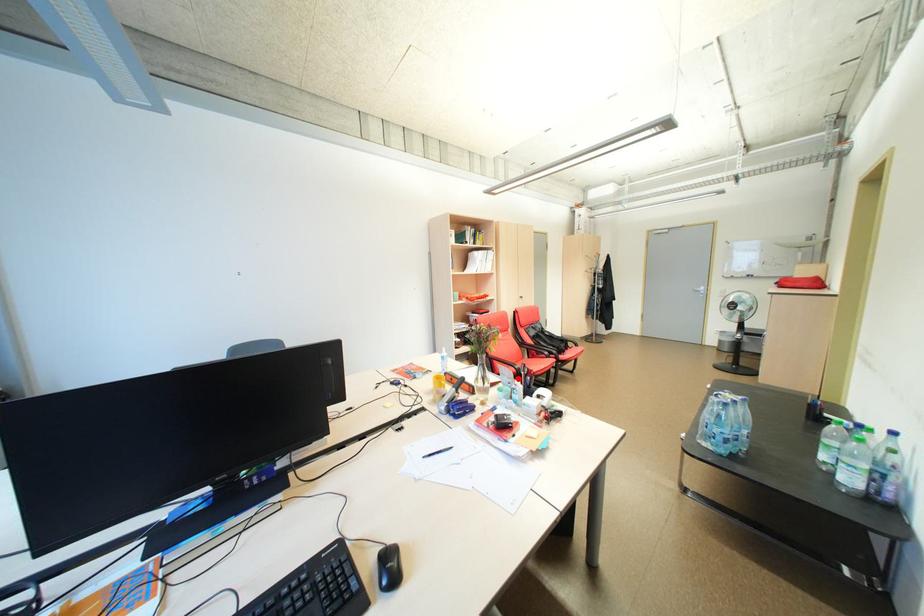
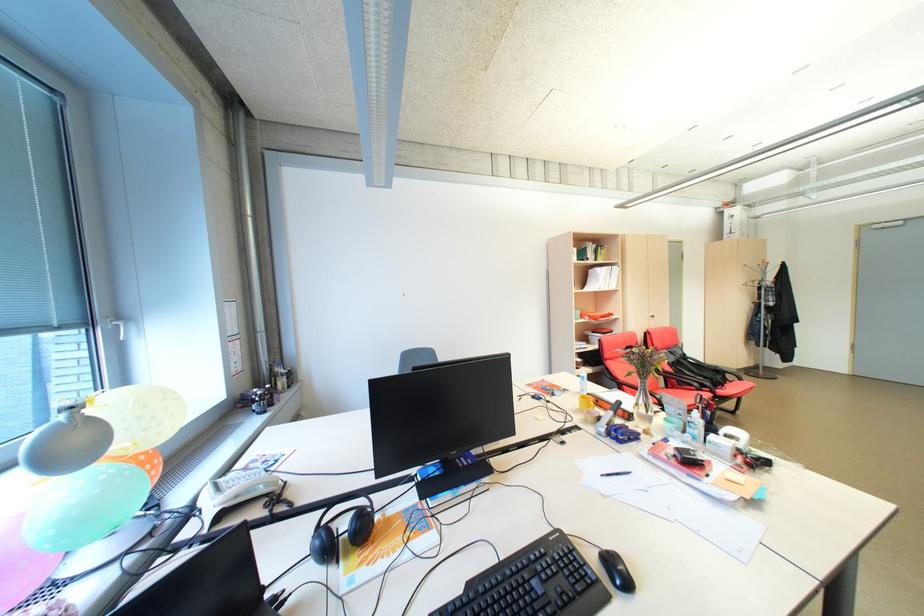
Question: I am providing you with two images of the same scene from different viewpoints. In image1, a red point is highlighted. Considering the same 3D point in image2, which of the following is correct?

Choices:
 (A) It is closer
 (B) It is farther

Answer: (B)